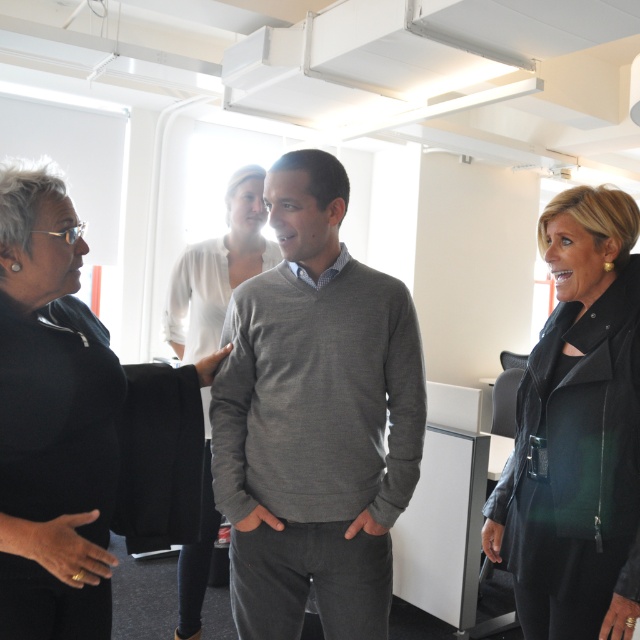
Question: Which point appears farthest from the camera in this image?

Choices:
 (A) (620, 259)
 (B) (221, 240)
 (C) (36, 602)
 (D) (291, 544)

Answer: (B)

Question: Is black leather jacket at right positioned in front of white silk blouse at center?

Choices:
 (A) no
 (B) yes

Answer: (B)

Question: Observing the image, what is the correct spatial positioning of gray sweater at center in reference to black leather jacket at right?

Choices:
 (A) above
 (B) below

Answer: (A)

Question: Is gray sweater at center below white silk blouse at center?

Choices:
 (A) no
 (B) yes

Answer: (A)

Question: Which point appears farthest from the camera in this image?

Choices:
 (A) (356, 486)
 (B) (113, 397)
 (C) (216, 515)

Answer: (C)

Question: Which point is farther to the camera?

Choices:
 (A) white silk blouse at center
 (B) black leather jacket at right

Answer: (A)